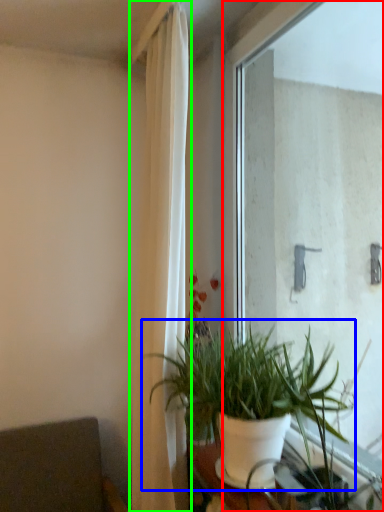
Question: Considering the real-world distances, which object is closest to window (highlighted by a red box)? houseplant (highlighted by a blue box) or curtain (highlighted by a green box).

Choices:
 (A) houseplant
 (B) curtain

Answer: (A)